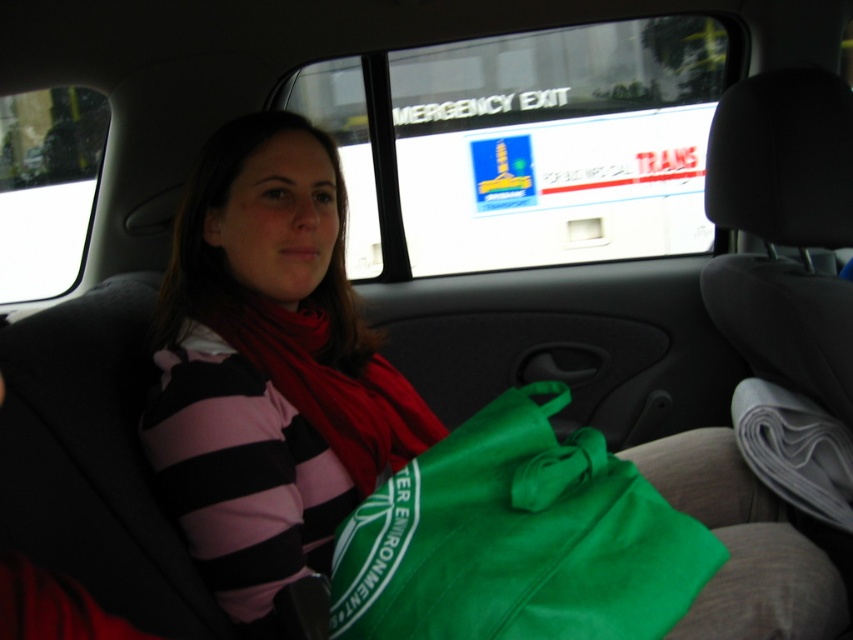
Question: Which object is positioned closest to the green fabric bag at center?

Choices:
 (A) striped cotton shirt at center
 (B) red soft scarf at center

Answer: (A)

Question: Which point is farther to the camera?

Choices:
 (A) green fabric bag at center
 (B) striped cotton shirt at center

Answer: (B)

Question: Is striped cotton shirt at center to the left of green fabric bag at center from the viewer's perspective?

Choices:
 (A) yes
 (B) no

Answer: (A)

Question: Which point appears closest to the camera in this image?

Choices:
 (A) (329, 362)
 (B) (341, 429)

Answer: (B)

Question: Is striped cotton shirt at center to the right of green fabric bag at center from the viewer's perspective?

Choices:
 (A) no
 (B) yes

Answer: (A)

Question: Does striped cotton shirt at center appear on the right side of red soft scarf at center?

Choices:
 (A) no
 (B) yes

Answer: (A)